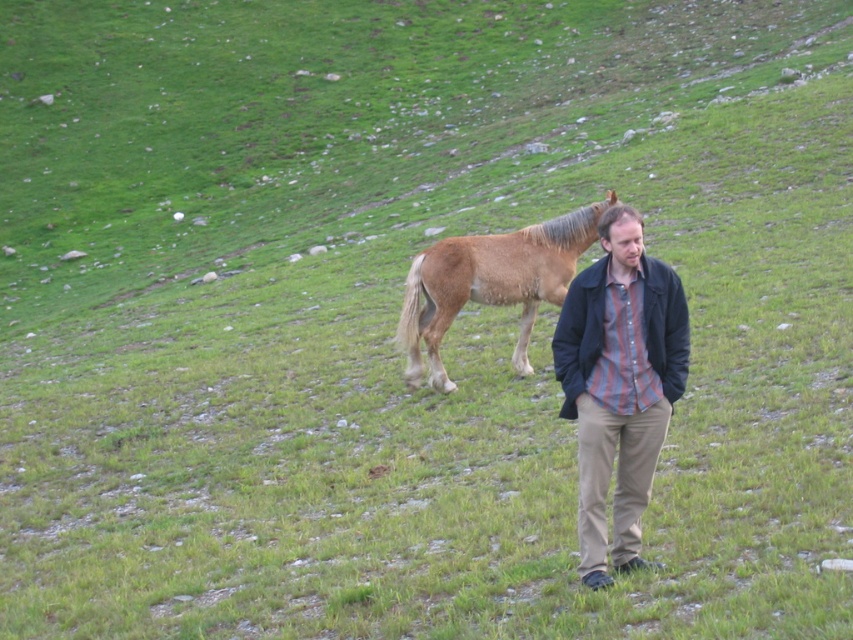
You are a photographer trying to capture a photo of the striped cotton shirt at center and the brown fuzzy horse at center. Based on their positions, which object should you focus on first if you want to ensure both are in sharp focus?

The striped cotton shirt at center is positioned under the brown fuzzy horse at center. Therefore, you should focus on the brown fuzzy horse at center first, as it is closer to the camera, ensuring both will be in focus when using a shallow depth of field.

You are a photographer trying to capture a clear photo of both the striped cotton shirt at center and the brown fuzzy horse at center. Since you want the shirt to be the main focus, which object should you zoom in on more to ensure it appears larger in the final photo?

The striped cotton shirt at center is larger in size than the brown fuzzy horse at center, so to make the shirt the main focus, you should zoom in on the striped cotton shirt at center more to ensure it appears larger in the final photo.